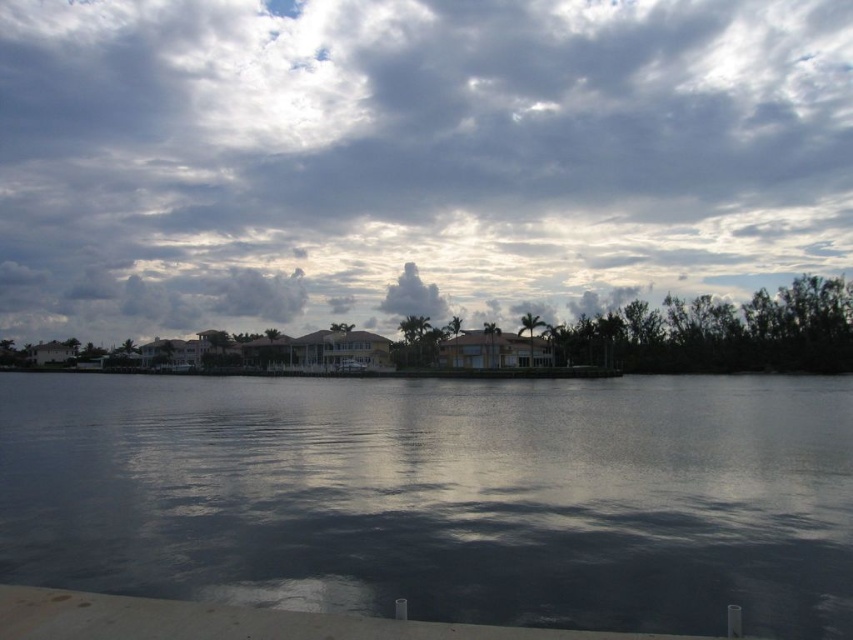
Question: From the image, what is the correct spatial relationship of cloudy sky at upper center in relation to dark reflective water at center?

Choices:
 (A) left
 (B) right

Answer: (B)

Question: Which object is the closest to the white fluffy cloud at upper center?

Choices:
 (A) dark reflective water at center
 (B) cloudy sky at upper center

Answer: (B)

Question: Does cloudy sky at upper center appear over white fluffy cloud at upper center?

Choices:
 (A) no
 (B) yes

Answer: (B)

Question: Which object is the closest to the cloudy sky at upper center?

Choices:
 (A) white fluffy cloud at upper center
 (B) dark reflective water at center

Answer: (A)

Question: Can you confirm if cloudy sky at upper center is positioned to the left of white fluffy cloud at upper center?

Choices:
 (A) yes
 (B) no

Answer: (A)

Question: Estimate the real-world distances between objects in this image. Which object is farther from the cloudy sky at upper center?

Choices:
 (A) white fluffy cloud at upper center
 (B) dark reflective water at center

Answer: (B)